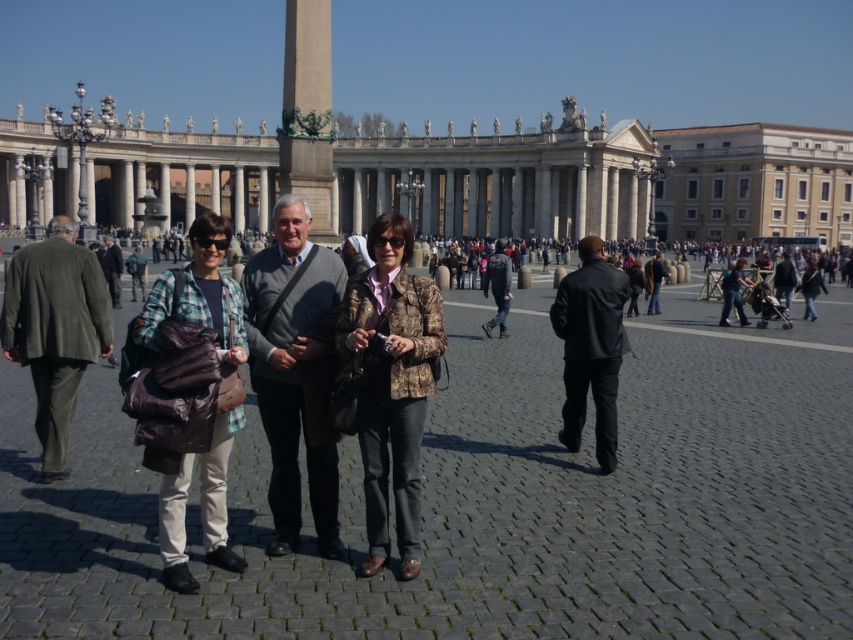
Is gray sweater at center below dark green suit at left?

Correct, gray sweater at center is located below dark green suit at left.

Which of these two, gray sweater at center or dark green suit at left, stands shorter?

Standing shorter between the two is dark green suit at left.

Measure the distance between gray sweater at center and camera.

gray sweater at center is 48.32 meters away from camera.

In order to click on gray sweater at center in this screenshot , I will do `click(292, 369)`.

Which is more to the left, dark gray leather jacket at center or dark gray jacket at center?

dark gray leather jacket at center

Is dark gray leather jacket at center smaller than dark gray jacket at center?

Yes.

This screenshot has width=853, height=640. Describe the element at coordinates (498, 288) in the screenshot. I see `dark gray leather jacket at center` at that location.

This screenshot has height=640, width=853. I want to click on dark gray leather jacket at center, so click(498, 288).

Between point (418, 481) and point (289, 374), which one is positioned behind?

The point (289, 374) is behind.

How much distance is there between camouflage-patterned jacket at center and gray sweater at center?

camouflage-patterned jacket at center is 3.61 meters away from gray sweater at center.

Is point (370, 388) farther from camera compared to point (292, 464)?

No, it is in front of (292, 464).

Where is `camouflage-patterned jacket at center`? Image resolution: width=853 pixels, height=640 pixels. camouflage-patterned jacket at center is located at coordinates (390, 384).